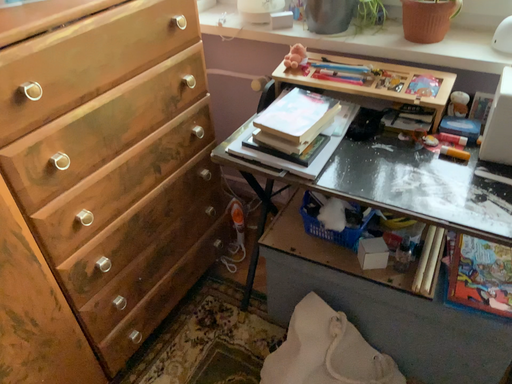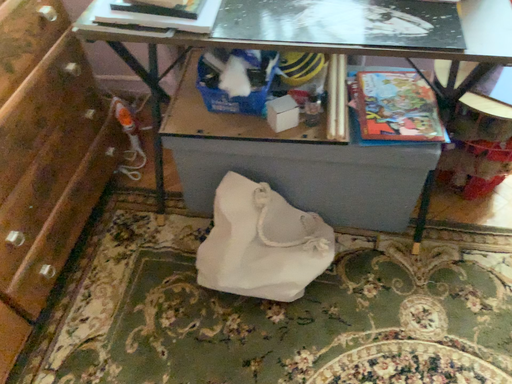
Question: Which way did the camera rotate in the video?

Choices:
 (A) rotated downward
 (B) rotated upward

Answer: (A)